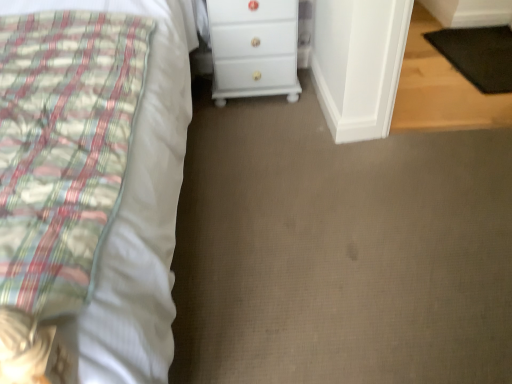
Find the location of a particular element. white glossy chest of drawers at center is located at coordinates (254, 48).

What is the approximate height of white glossy chest of drawers at center?

white glossy chest of drawers at center is 21.37 inches in height.

The width and height of the screenshot is (512, 384). In order to click on white cotton bed at left in this screenshot , I will do pyautogui.click(x=140, y=207).

From the picture: Between white cotton bed at left and black rubber mat at lower right, which one is positioned in front?

white cotton bed at left.

Looking at this image, which object is thinner, white cotton bed at left or black rubber mat at lower right?

With smaller width is black rubber mat at lower right.

Where is `pad below the white cotton bed at left (from a real-world perspective)`? This screenshot has height=384, width=512. pad below the white cotton bed at left (from a real-world perspective) is located at coordinates (478, 55).

In the scene shown: How different are the orientations of white cotton bed at left and black rubber mat at lower right in degrees?

There is a 87.6-degree angle between the facing directions of white cotton bed at left and black rubber mat at lower right.

Between white glossy chest of drawers at center and black rubber mat at lower right, which one has larger size?

With larger size is white glossy chest of drawers at center.

From a real-world perspective, relative to black rubber mat at lower right, is white glossy chest of drawers at center vertically above or below?

white glossy chest of drawers at center is situated higher than black rubber mat at lower right in the real world.

How many degrees apart are the facing directions of white glossy chest of drawers at center and black rubber mat at lower right?

There is a 87.6-degree angle between the facing directions of white glossy chest of drawers at center and black rubber mat at lower right.

Is white glossy chest of drawers at center next to black rubber mat at lower right?

white glossy chest of drawers at center and black rubber mat at lower right are not in contact.

At what (x,y) coordinates should I click in order to perform the action: click on chest of drawers on the right of white cotton bed at left. Please return your answer as a coordinate pair (x, y). Looking at the image, I should click on (254, 48).

Who is shorter, white cotton bed at left or white glossy chest of drawers at center?

white glossy chest of drawers at center.

Is white cotton bed at left facing away from white glossy chest of drawers at center?

No, white cotton bed at left is not facing away from white glossy chest of drawers at center.

You are a GUI agent. You are given a task and a screenshot of the screen. Output one action in this format:
    pyautogui.click(x=<x>, y=<y>)
    Task: Click on the chest of drawers in front of the black rubber mat at lower right
    The width and height of the screenshot is (512, 384).
    Given the screenshot: What is the action you would take?
    pyautogui.click(x=254, y=48)

Is black rubber mat at lower right positioned far away from white glossy chest of drawers at center?

Yes, black rubber mat at lower right and white glossy chest of drawers at center are located far from each other.

In the scene shown: What's the angular difference between black rubber mat at lower right and white glossy chest of drawers at center's facing directions?

87.6 degrees.

Is black rubber mat at lower right taller than white glossy chest of drawers at center?

No.

From the image's perspective, which one is positioned lower, white glossy chest of drawers at center or white cotton bed at left?

white cotton bed at left, from the image's perspective.

Considering the positions of objects white glossy chest of drawers at center and white cotton bed at left in the image provided, who is more to the right, white glossy chest of drawers at center or white cotton bed at left?

Positioned to the right is white glossy chest of drawers at center.

Is white glossy chest of drawers at center positioned beyond the bounds of white cotton bed at left?

Yes.

Identify the location of chest of drawers behind the white cotton bed at left. The image size is (512, 384). (254, 48).

Is black rubber mat at lower right wider than white cotton bed at left?

Incorrect, the width of black rubber mat at lower right does not surpass that of white cotton bed at left.

Is black rubber mat at lower right not near white cotton bed at left?

Yes, black rubber mat at lower right and white cotton bed at left are located far from each other.

Between point (465, 28) and point (87, 334), which one is positioned in front?

Point (87, 334)

Where is `bed below the black rubber mat at lower right (from the image's perspective)`? bed below the black rubber mat at lower right (from the image's perspective) is located at coordinates (140, 207).

At what (x,y) coordinates should I click in order to perform the action: click on chest of drawers located on the left of black rubber mat at lower right. Please return your answer as a coordinate pair (x, y). Looking at the image, I should click on (254, 48).

When comparing their distances from white cotton bed at left, does black rubber mat at lower right or white glossy chest of drawers at center seem further?

black rubber mat at lower right is further to white cotton bed at left.

Considering their positions, is black rubber mat at lower right positioned closer to white glossy chest of drawers at center than white cotton bed at left?

Among the two, white cotton bed at left is located nearer to white glossy chest of drawers at center.

Consider the image. When comparing their distances from black rubber mat at lower right, does white glossy chest of drawers at center or white cotton bed at left seem further?

white cotton bed at left is positioned further to the anchor black rubber mat at lower right.

Considering their positions, is white glossy chest of drawers at center positioned further to white cotton bed at left than black rubber mat at lower right?

black rubber mat at lower right is positioned further to the anchor white cotton bed at left.

When comparing their distances from black rubber mat at lower right, does white cotton bed at left or white glossy chest of drawers at center seem further?

white cotton bed at left lies further to black rubber mat at lower right than the other object.

Which object lies nearer to the anchor point white glossy chest of drawers at center, white cotton bed at left or black rubber mat at lower right?

white cotton bed at left is positioned closer to the anchor white glossy chest of drawers at center.

This screenshot has width=512, height=384. I want to click on chest of drawers between white cotton bed at left and black rubber mat at lower right from left to right, so click(254, 48).